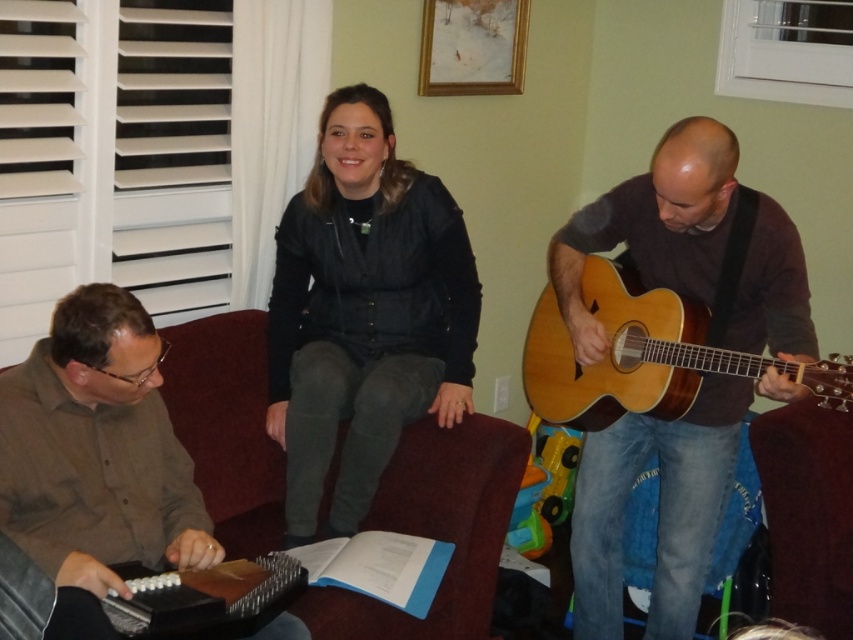
Is the position of black leather jacket at center more distant than that of natural wood acoustic guitar at right?

Yes, it is behind natural wood acoustic guitar at right.

Image resolution: width=853 pixels, height=640 pixels. Describe the element at coordinates (363, 312) in the screenshot. I see `black leather jacket at center` at that location.

Identify the location of black leather jacket at center. This screenshot has width=853, height=640. click(x=363, y=312).

Which is more to the left, black leather jacket at center or brown shirt at left?

brown shirt at left is more to the left.

Who is higher up, black leather jacket at center or brown shirt at left?

black leather jacket at center

At what (x,y) coordinates should I click in order to perform the action: click on black leather jacket at center. Please return your answer as a coordinate pair (x, y). The height and width of the screenshot is (640, 853). Looking at the image, I should click on (363, 312).

Does matte brown guitar at right appear under black leather jacket at center?

Correct, matte brown guitar at right is located below black leather jacket at center.

Which of these two, matte brown guitar at right or black leather jacket at center, stands taller?

With more height is matte brown guitar at right.

Measure the distance between matte brown guitar at right and camera.

matte brown guitar at right and camera are 1.78 meters apart.

The width and height of the screenshot is (853, 640). Identify the location of matte brown guitar at right. (694, 248).